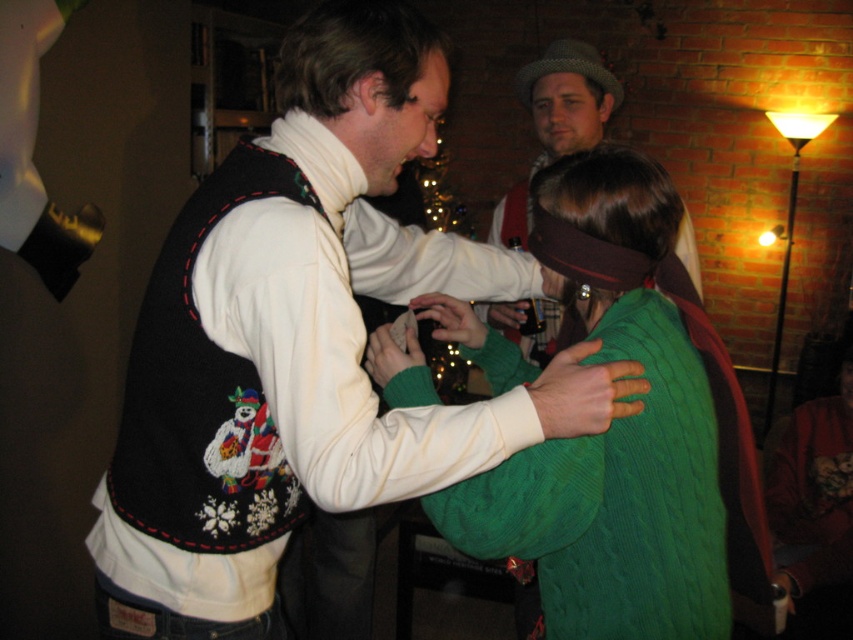
Question: Which point is closer to the camera?

Choices:
 (A) (405, 369)
 (B) (285, 76)
 (C) (500, 324)

Answer: (A)

Question: Does green cable-knit sweater at center have a larger size compared to knitted wool hat at upper center?

Choices:
 (A) yes
 (B) no

Answer: (B)

Question: Which of the following is the farthest from the observer?

Choices:
 (A) (529, 467)
 (B) (283, 452)
 (C) (579, 48)

Answer: (C)

Question: Which of these objects is positioned closest to the knitted wool hat at upper center?

Choices:
 (A) white sweater vest with snowman design at center
 (B) green cable-knit sweater at center

Answer: (B)

Question: Can you confirm if white sweater vest with snowman design at center is bigger than knitted wool hat at upper center?

Choices:
 (A) no
 (B) yes

Answer: (B)

Question: Can you confirm if white sweater vest with snowman design at center is positioned above knitted wool hat at upper center?

Choices:
 (A) no
 (B) yes

Answer: (A)